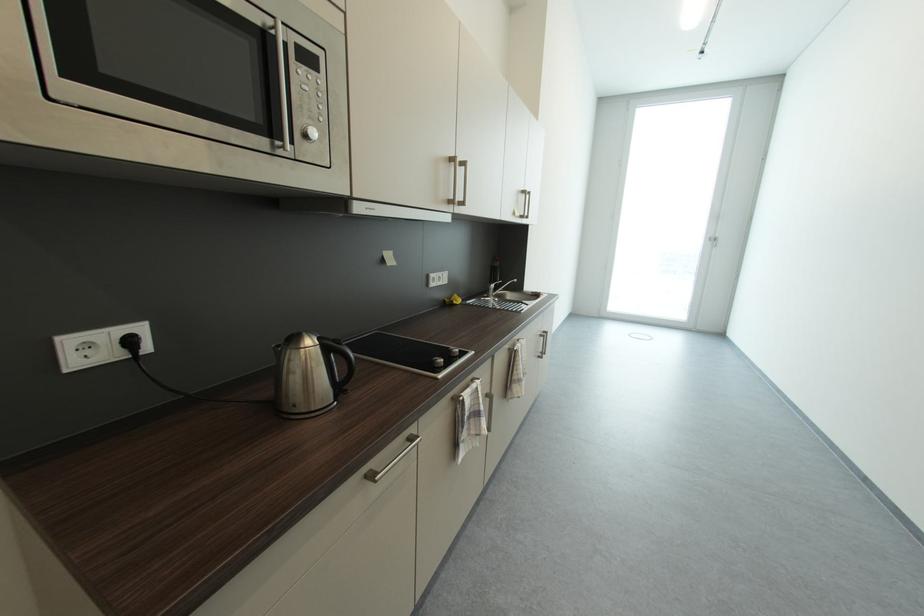
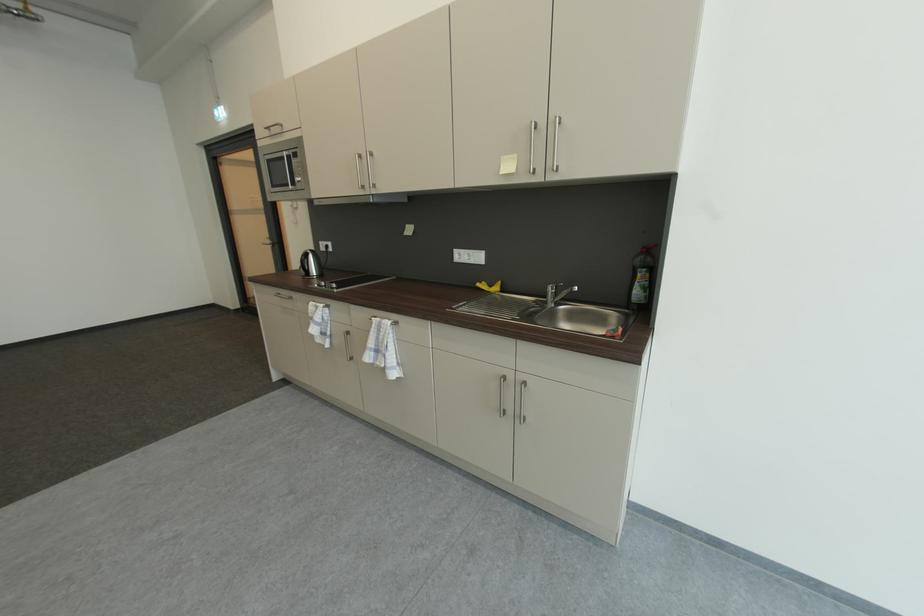
Where in the second image is the point corresponding to (x=453, y=302) from the first image?

(487, 284)